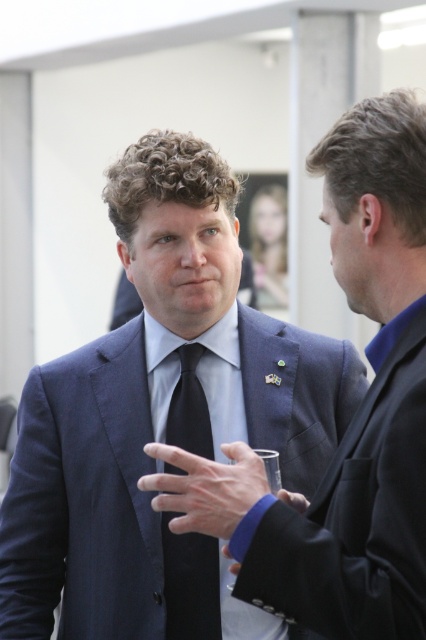
You are a photographer setting up for a portrait. You need to focus on the navy blue fabric suit at center and the black silk tie at center. Which one should you adjust your camera focus to prioritize if the subject is moving closer to you?

The navy blue fabric suit at center is closer to the viewer than the black silk tie at center, so you should prioritize focusing on the navy blue fabric suit at center to maintain sharpness as the subject moves closer.

You are a photographer at a formal event. You need to capture a clear photo of the person in the navy blue suit at center without including the navy blue fabric suit at center in the background. Is this possible given their positions?

The navy blue fabric suit at center is behind the navy blue suit at center, so if you position the camera so the navy blue suit at center is in front, you can take the photo without the navy blue fabric suit at center appearing in the frame.

You are a tailor measuring the distance between two navy blue suits in the image. The first is labeled as navy blue suit at center, and the second is navy blue fabric suit at center. Which one is closer to the viewer?

The navy blue suit at center is closer to the viewer than the navy blue fabric suit at center by 34.19 inches.